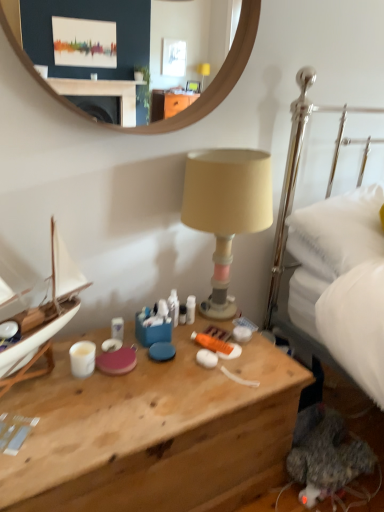
The width and height of the screenshot is (384, 512). I want to click on free location in front of white glossy coffee cup at lower left, so click(69, 406).